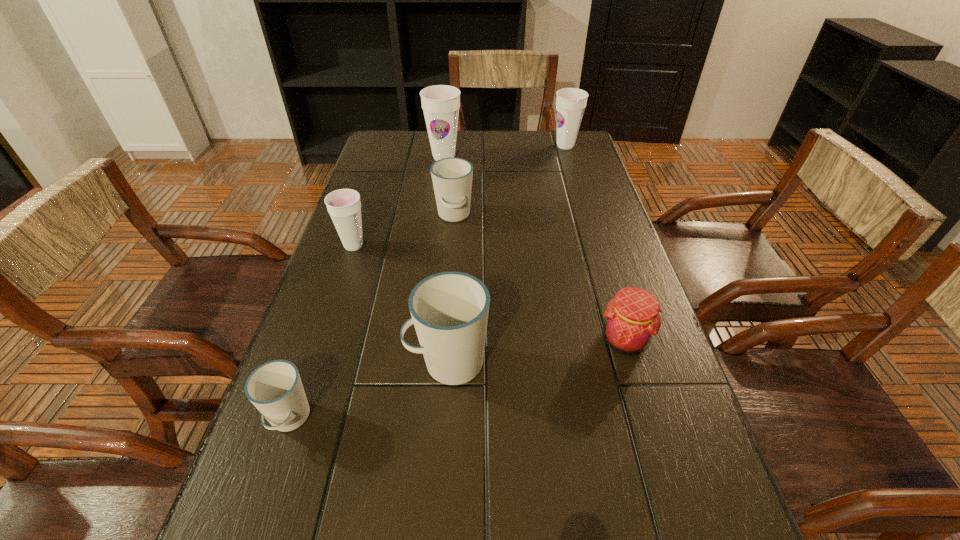
Choose which white cup is the second nearest neighbor to the leftmost white cup. Please provide its 2D coordinates. Your answer should be formatted as a tuple, i.e. [(x, y)], where the tuple contains the x and y coordinates of a point satisfying the conditions above.

[(452, 177)]

Locate which white cup is the closest to the biggest white cup. Please provide its 2D coordinates. Your answer should be formatted as a tuple, i.e. [(x, y)], where the tuple contains the x and y coordinates of a point satisfying the conditions above.

[(275, 388)]

At what (x,y) coordinates should I click in order to perform the action: click on vacant space that satisfies the following two spatial constraints: 1. on the front side of the tallest object; 2. on the left side of the red jam. Please return your answer as a coordinate pair (x, y). The width and height of the screenshot is (960, 540). Looking at the image, I should click on pyautogui.click(x=421, y=340).

Find the location of a particular element. The height and width of the screenshot is (540, 960). vacant area that satisfies the following two spatial constraints: 1. on the back side of the leftmost purple cup; 2. on the right side of the second smallest purple cup is located at coordinates (387, 146).

I want to click on vacant space that satisfies the following two spatial constraints: 1. on the front side of the second biggest purple cup; 2. on the right side of the red jam, so click(624, 340).

Image resolution: width=960 pixels, height=540 pixels. Find the location of `free space that satisfies the following two spatial constraints: 1. on the front side of the jam; 2. on the left side of the rightmost purple cup`. free space that satisfies the following two spatial constraints: 1. on the front side of the jam; 2. on the left side of the rightmost purple cup is located at coordinates [624, 340].